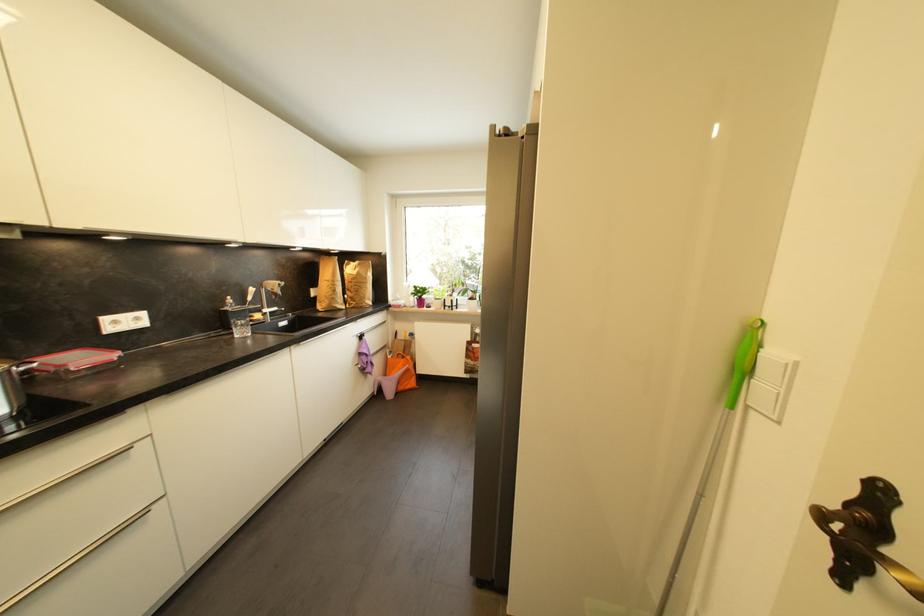
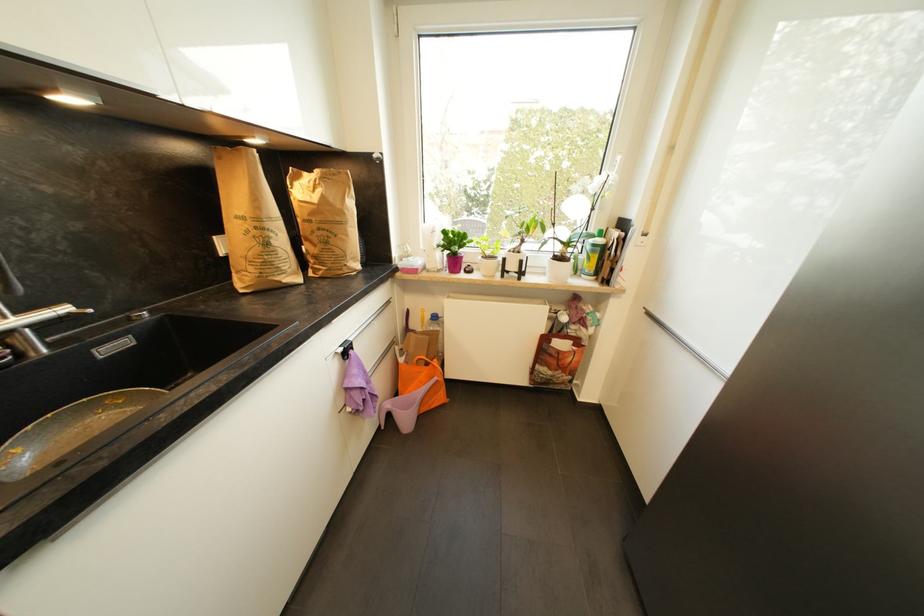
The point at (384, 381) is marked in the first image. Where is the corresponding point in the second image?

(393, 407)